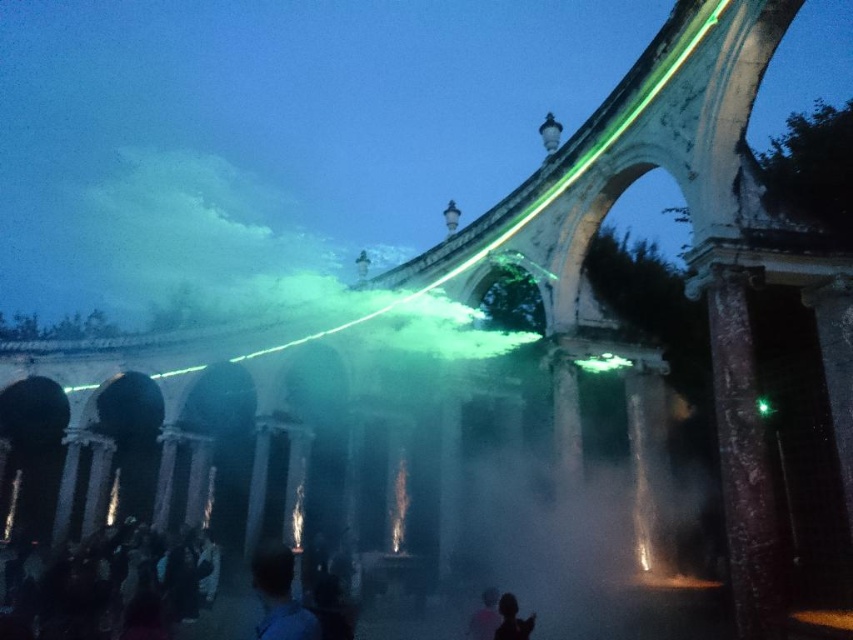
Is silhouette skin at lower center to the left of green laser beam at center from the viewer's perspective?

Correct, you'll find silhouette skin at lower center to the left of green laser beam at center.

Does silhouette skin at lower center appear over green laser beam at center?

Actually, silhouette skin at lower center is below green laser beam at center.

Between point (512, 637) and point (763, 403), which one is positioned in front?

Point (512, 637) is more forward.

Find the location of `silhouette skin at lower center`. silhouette skin at lower center is located at coordinates (512, 620).

Between silhouette skin at lower center and silvery metallic figure at center, which one has more height?

Standing taller between the two is silvery metallic figure at center.

Where is `silhouette skin at lower center`? The height and width of the screenshot is (640, 853). silhouette skin at lower center is located at coordinates (512, 620).

This screenshot has width=853, height=640. What are the coordinates of `silhouette skin at lower center` in the screenshot? It's located at (512, 620).

Is point (735, 276) in front of point (289, 552)?

Yes, point (735, 276) is in front of point (289, 552).

Which is behind, point (744, 422) or point (282, 604)?

Point (282, 604)

Between point (726, 358) and point (318, 630), which one is positioned in front?

Positioned in front is point (726, 358).

The height and width of the screenshot is (640, 853). Find the location of `brown marble pillar at right`. brown marble pillar at right is located at coordinates (743, 461).